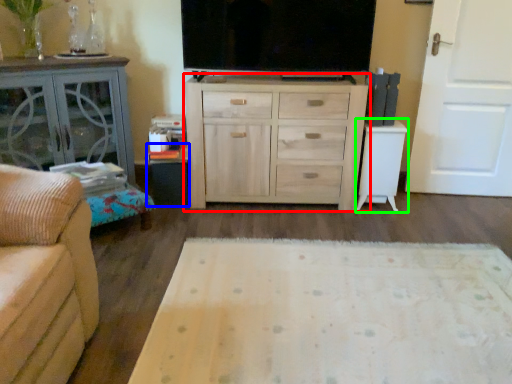
Question: Which object is the farthest from chest of drawers (highlighted by a red box)? Choose among these: table (highlighted by a blue box) or table (highlighted by a green box).

Choices:
 (A) table
 (B) table

Answer: (A)